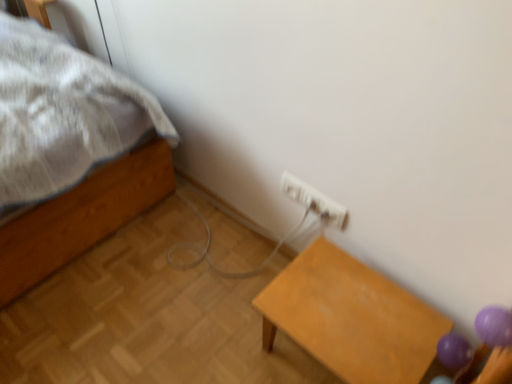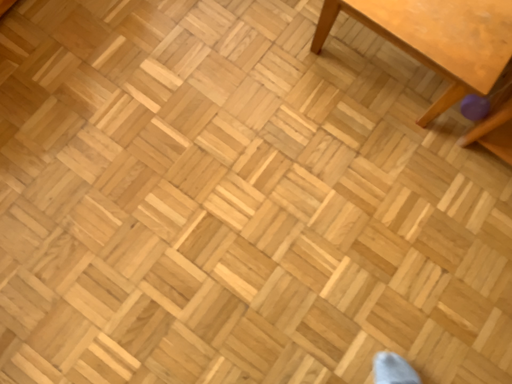
Question: How did the camera likely rotate when shooting the video?

Choices:
 (A) rotated downward
 (B) rotated upward

Answer: (A)